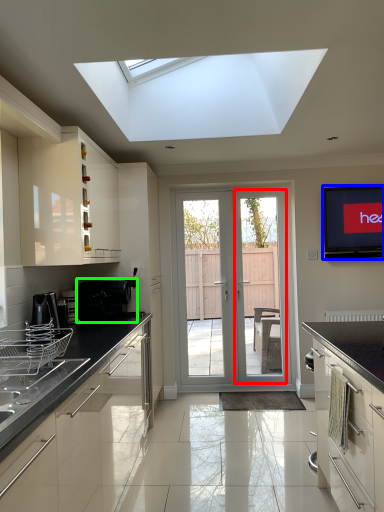
Question: Considering the real-world distances, which object is closest to screen door (highlighted by a red box)? electronic (highlighted by a blue box) or appliance (highlighted by a green box).

Choices:
 (A) electronic
 (B) appliance

Answer: (A)